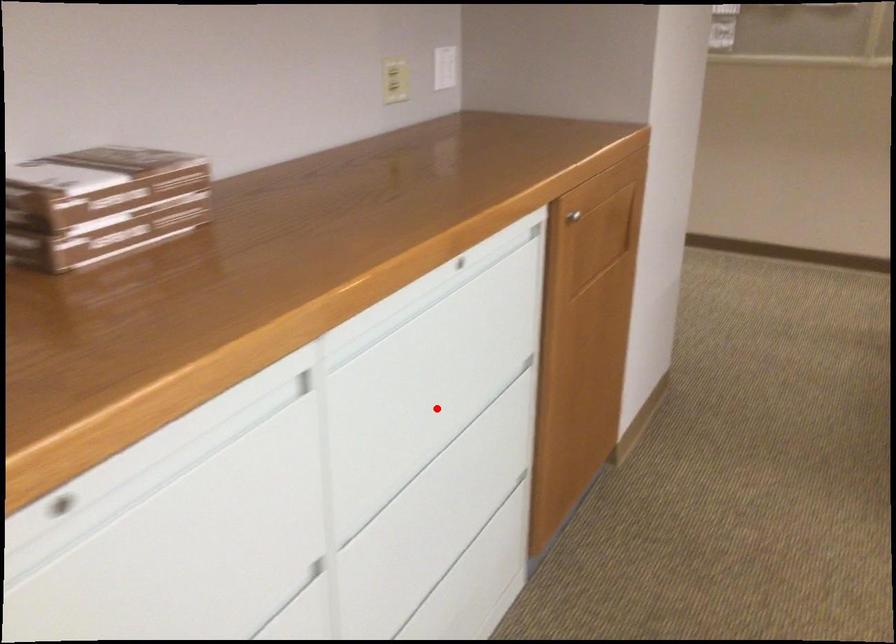
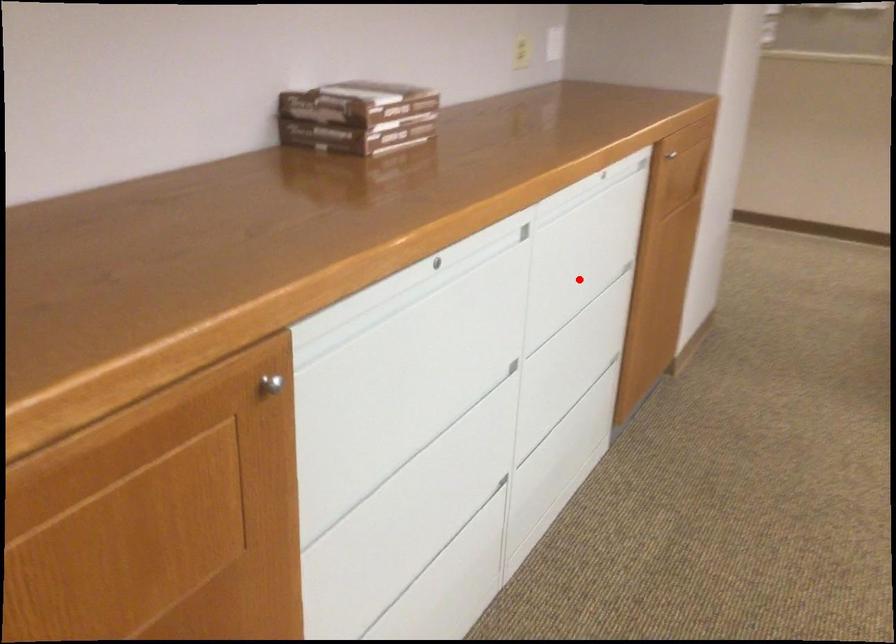
I am providing you with two images of the same scene from different viewpoints. A red point is marked on the first image and another point is marked on the second image. Does the point marked in image1 correspond to the same location as the one in image2?

Yes